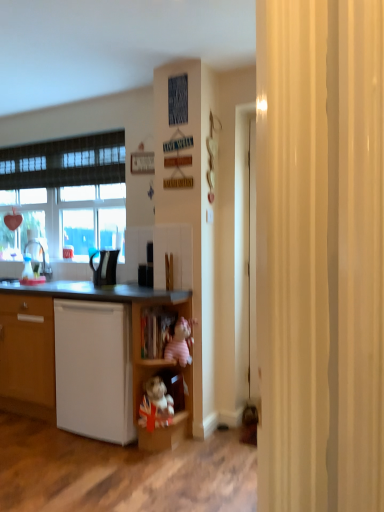
This screenshot has width=384, height=512. What are the coordinates of `free space to the left of wooden shelf at center` in the screenshot? It's located at (109, 451).